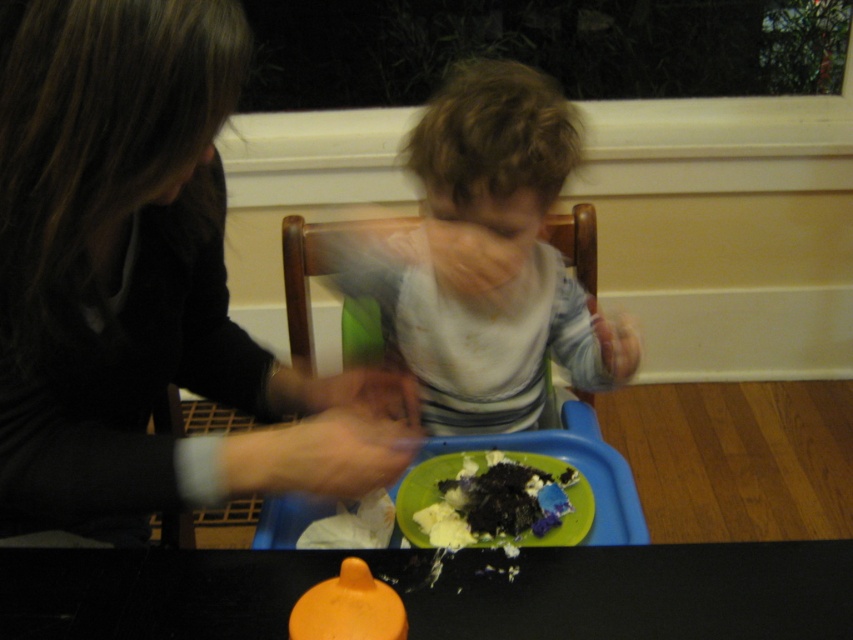
Does black plastic table at lower center lie behind dark crumbly cake at lower center?

No, black plastic table at lower center is closer to the viewer.

Between black plastic table at lower center and dark crumbly cake at lower center, which one appears on the left side from the viewer's perspective?

black plastic table at lower center

Which is in front, point (131, 568) or point (456, 472)?

Point (131, 568) is more forward.

You are a GUI agent. You are given a task and a screenshot of the screen. Output one action in this format:
    pyautogui.click(x=<x>, y=<y>)
    Task: Click on the black plastic table at lower center
    This screenshot has width=853, height=640.
    Given the screenshot: What is the action you would take?
    pyautogui.click(x=440, y=592)

In the scene shown: Between matte black jacket at upper left and black plastic table at lower center, which one has more height?

matte black jacket at upper left

Based on the photo, who is shorter, matte black jacket at upper left or black plastic table at lower center?

With less height is black plastic table at lower center.

Where is `matte black jacket at upper left`? This screenshot has height=640, width=853. matte black jacket at upper left is located at coordinates (138, 280).

Does matte black jacket at upper left have a greater width compared to white striped shirt at center?

Indeed, matte black jacket at upper left has a greater width compared to white striped shirt at center.

Is matte black jacket at upper left below white striped shirt at center?

Yes.

This screenshot has height=640, width=853. Describe the element at coordinates (138, 280) in the screenshot. I see `matte black jacket at upper left` at that location.

The height and width of the screenshot is (640, 853). What are the coordinates of `matte black jacket at upper left` in the screenshot? It's located at (138, 280).